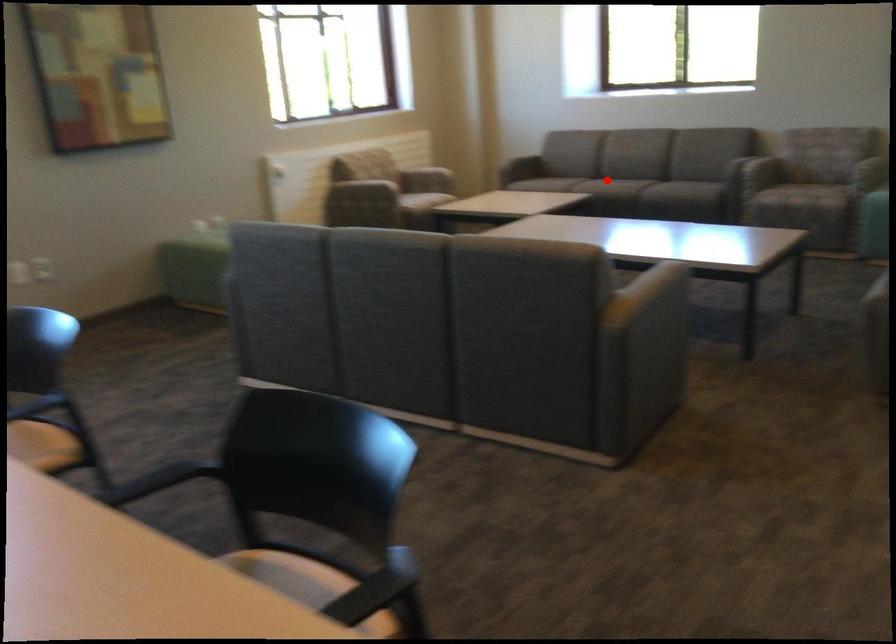
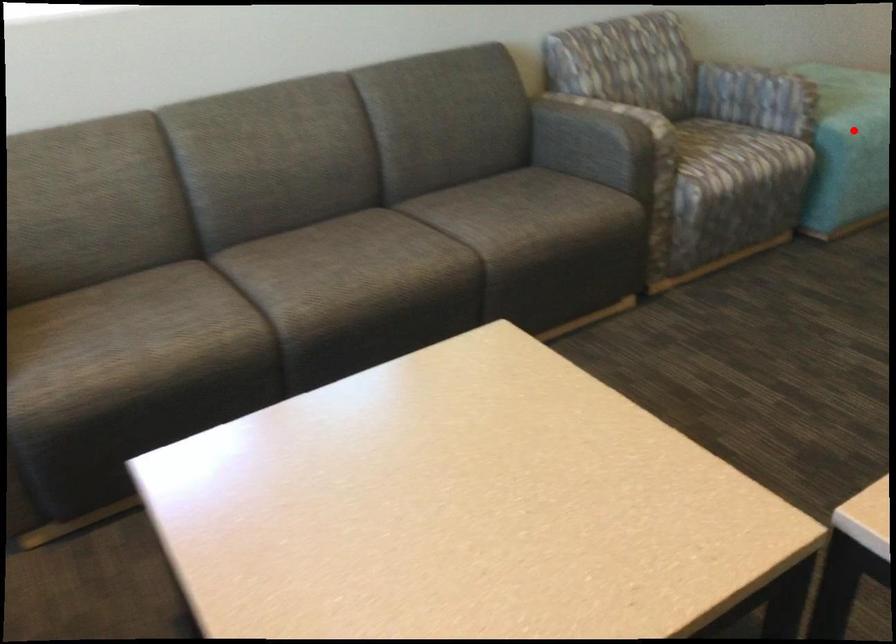
I am providing you with two images of the same scene from different viewpoints. A red point is marked on the first image and another point is marked on the second image. Do the highlighted points in image1 and image2 indicate the same real-world spot?

No